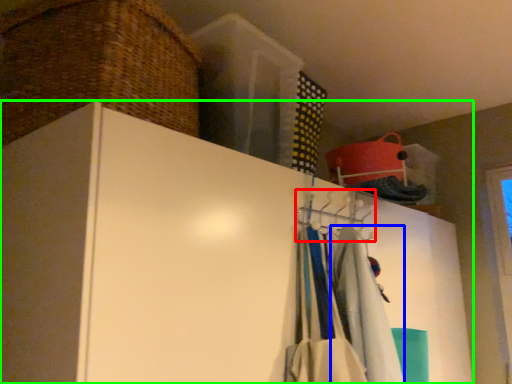
Question: Which object is positioned closest to hanger (highlighted by a red box)? Select from clothing (highlighted by a blue box) and cupboard (highlighted by a green box).

Choices:
 (A) clothing
 (B) cupboard

Answer: (A)